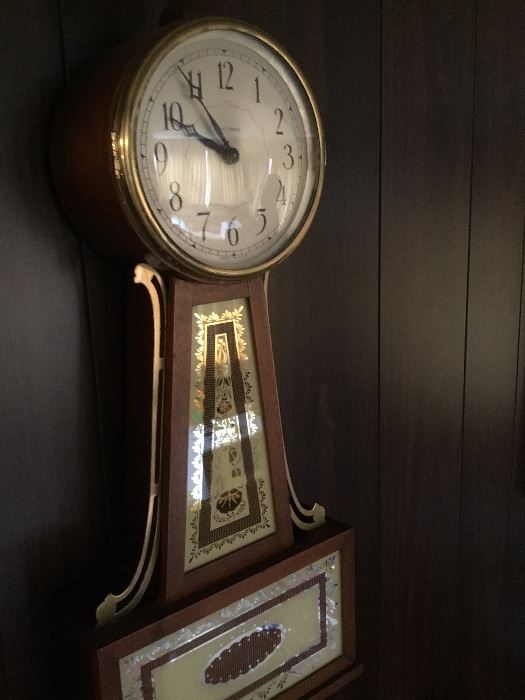
What are the coordinates of `wood pannel` in the screenshot? It's located at (416, 325).